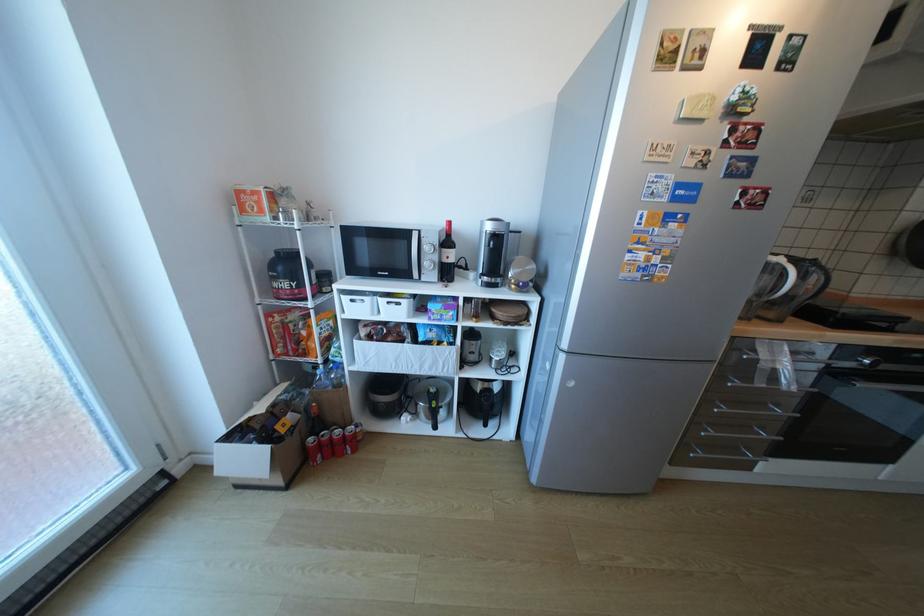
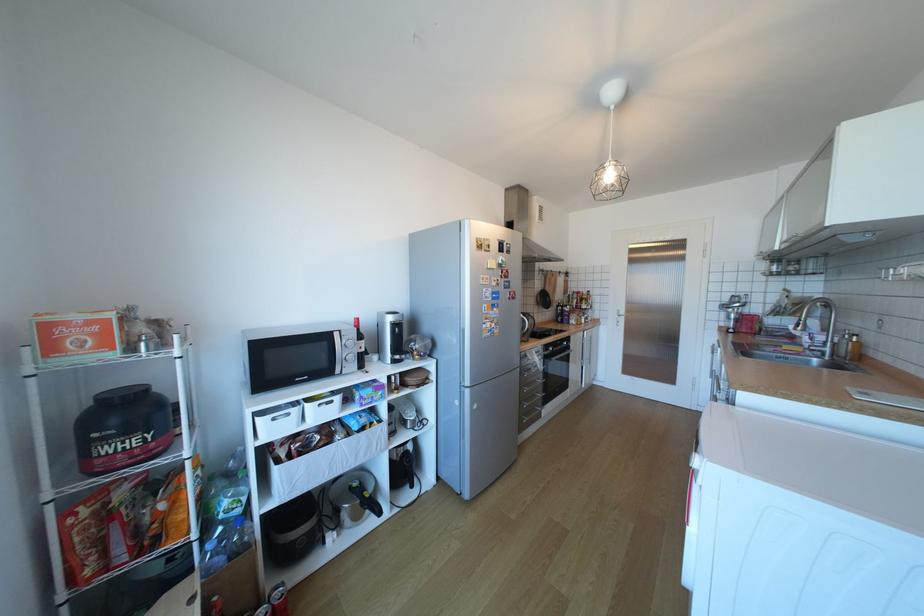
The point at (804,260) is marked in the first image. Where is the corresponding point in the second image?

(532, 314)